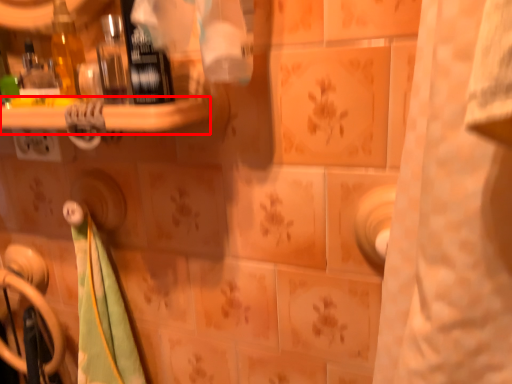
Question: In this image, where is ledge (annotated by the red box) located relative to door handle?

Choices:
 (A) right
 (B) left

Answer: (A)